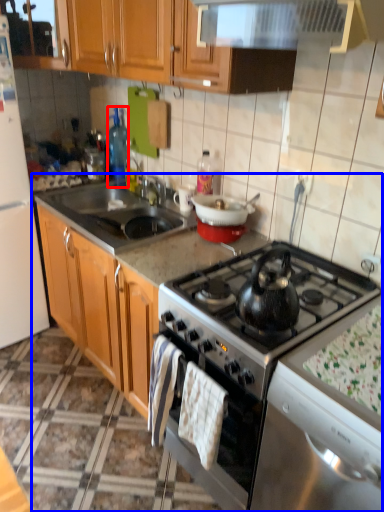
Question: Among these objects, which one is farthest to the camera, bottle (highlighted by a red box) or countertop (highlighted by a blue box)?

Choices:
 (A) bottle
 (B) countertop

Answer: (A)